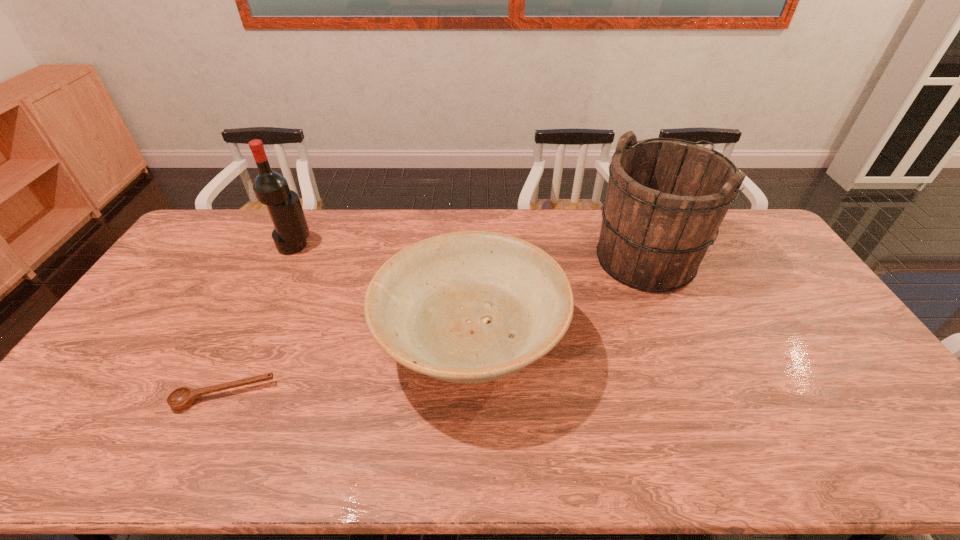
This screenshot has width=960, height=540. What are the coordinates of `vacant space that satisfies the following two spatial constraints: 1. on the back side of the third tallest object; 2. on the right side of the wooden spoon` in the screenshot? It's located at (249, 344).